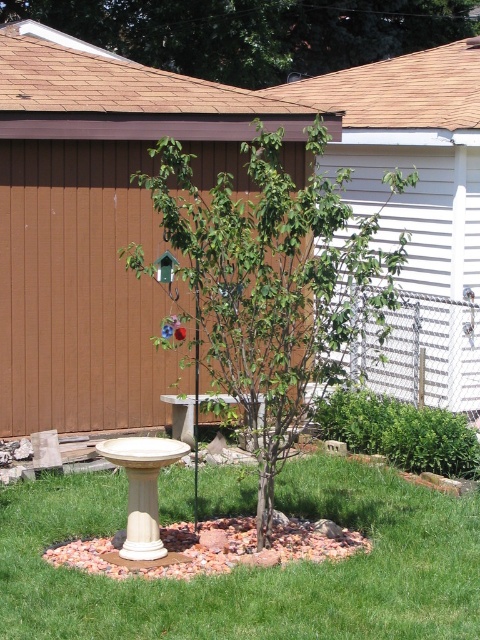
Question: Which of these objects is positioned farthest from the green leafy tree at upper center?

Choices:
 (A) green grass at center
 (B) green matte tree at center

Answer: (A)

Question: Which object is positioned closest to the green leafy tree at upper center?

Choices:
 (A) green grass at center
 (B) green matte tree at center

Answer: (B)

Question: Which object appears farthest from the camera in this image?

Choices:
 (A) green grass at center
 (B) green leafy tree at upper center
 (C) green matte tree at center

Answer: (B)

Question: Where is green grass at center located in relation to green leafy tree at upper center in the image?

Choices:
 (A) above
 (B) below

Answer: (B)

Question: Does green grass at center appear on the right side of green leafy tree at upper center?

Choices:
 (A) no
 (B) yes

Answer: (A)

Question: Can you confirm if green grass at center is positioned to the right of green leafy tree at upper center?

Choices:
 (A) yes
 (B) no

Answer: (B)